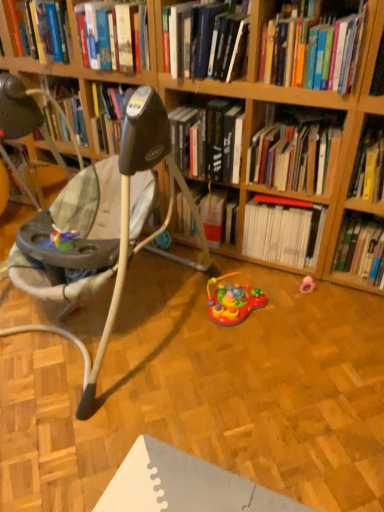
Identify the location of vacant space in front of pink rubber pacifier at lower right, the second toy from the left. The width and height of the screenshot is (384, 512). (322, 313).